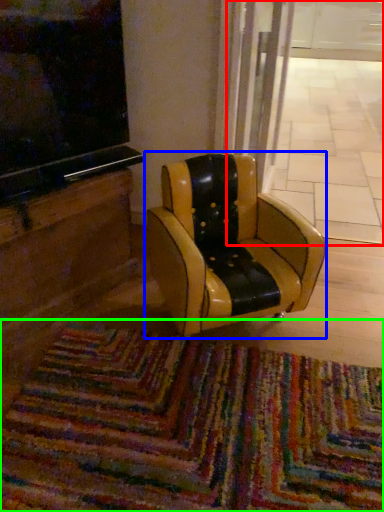
Question: Based on their relative distances, which object is farther from shop window (highlighted by a red box)? Choose from chair (highlighted by a blue box) and mat (highlighted by a green box).

Choices:
 (A) chair
 (B) mat

Answer: (B)